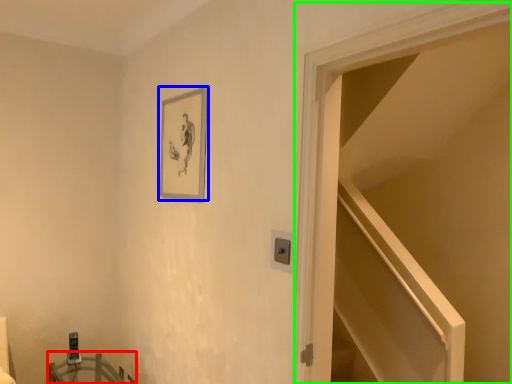
Question: Which object is the closest to the table (highlighted by a red box)? Choose among these: picture frame (highlighted by a blue box) or door (highlighted by a green box).

Choices:
 (A) picture frame
 (B) door

Answer: (A)